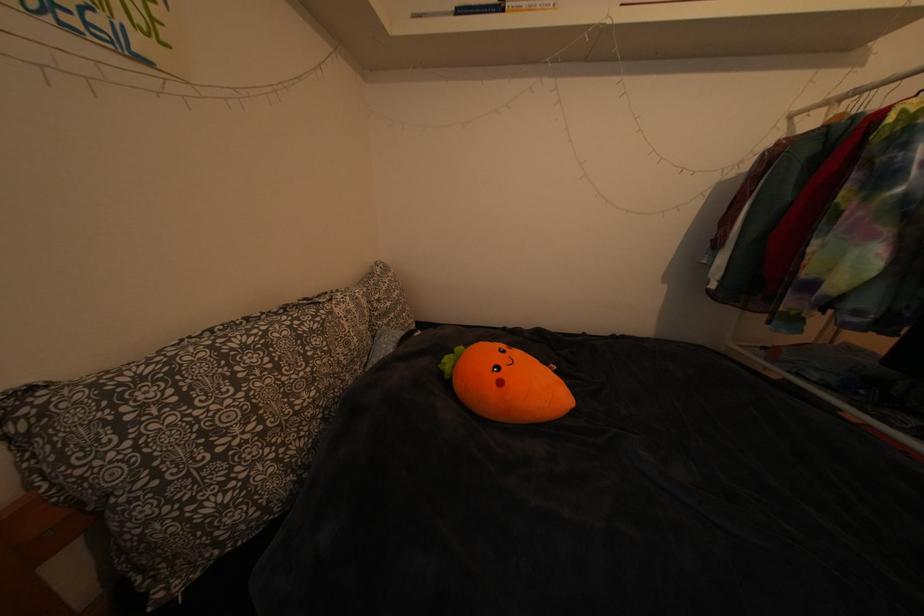
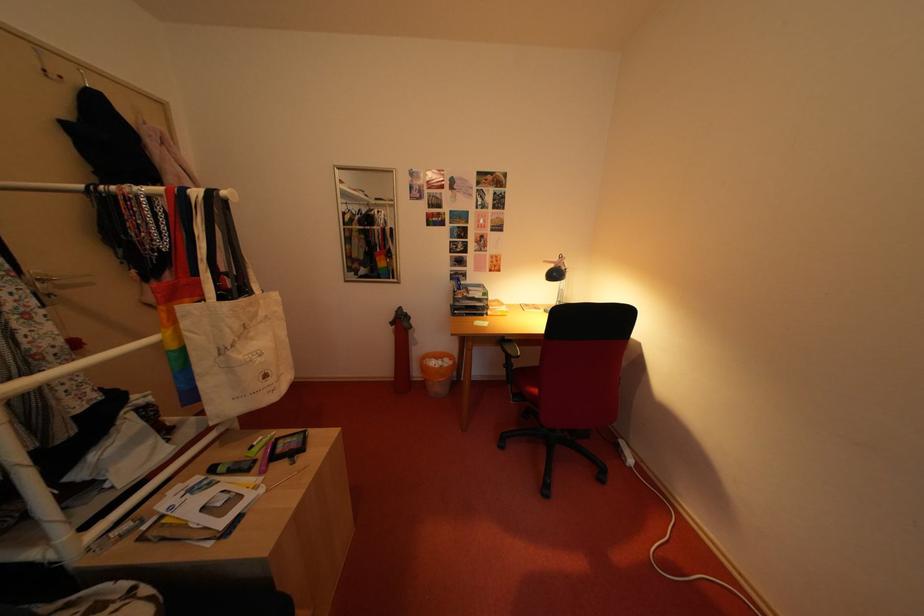
The images are taken continuously from a first-person perspective. In which direction is your viewpoint rotating?

The rotation direction of the camera is right-down.